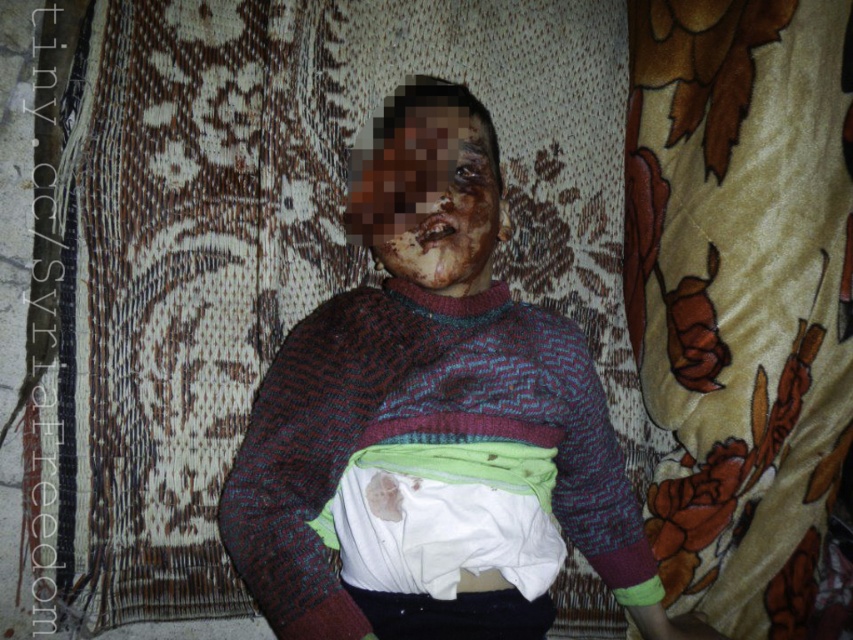
Question: Does knitted sweater at center appear under scarred skin at center?

Choices:
 (A) no
 (B) yes

Answer: (B)

Question: Can you confirm if knitted sweater at center is smaller than scarred skin at center?

Choices:
 (A) no
 (B) yes

Answer: (A)

Question: Does knitted sweater at center appear on the left side of scarred skin at center?

Choices:
 (A) no
 (B) yes

Answer: (A)

Question: Among these points, which one is farthest from the camera?

Choices:
 (A) (485, 548)
 (B) (473, 202)

Answer: (B)

Question: Which point is closer to the camera?

Choices:
 (A) (341, 637)
 (B) (450, 248)

Answer: (A)